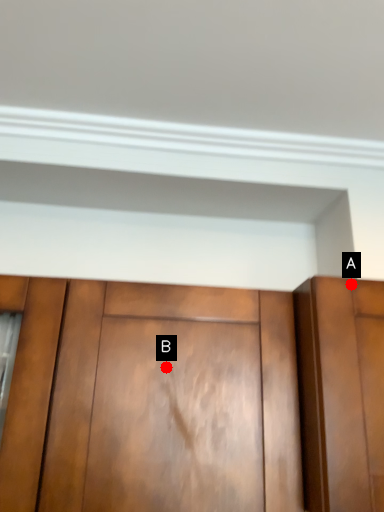
Question: Two points are circled on the image, labeled by A and B beside each circle. Which point is farther from the camera taking this photo?

Choices:
 (A) A is further
 (B) B is further

Answer: (B)